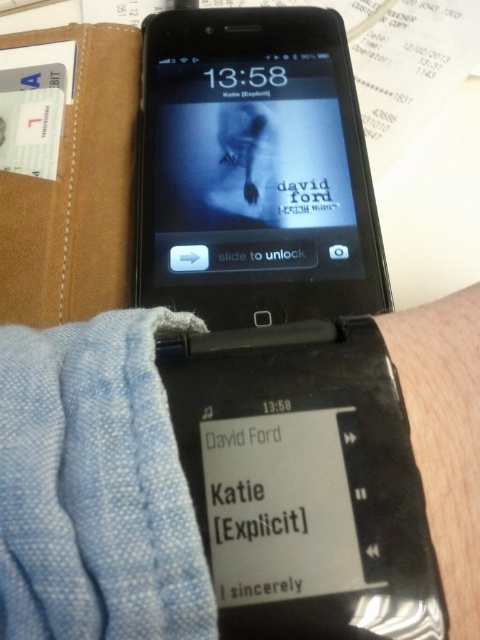
Identify the location of black glossy smartphone at center. (254, 170).

Who is higher up, black glossy smartphone at center or skinny silver bracelet at lower right?

black glossy smartphone at center is above.

Which is in front, point (298, 58) or point (475, 545)?

Point (475, 545) is more forward.

Identify the location of black glossy smartphone at center. (254, 170).